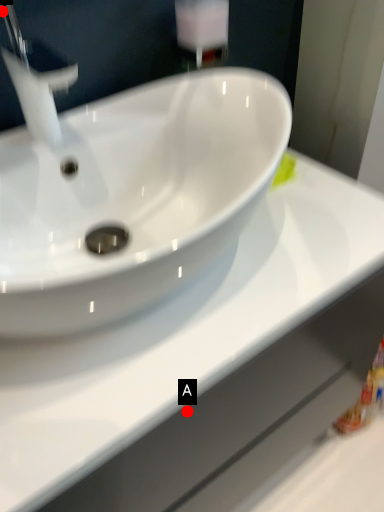
Question: Two points are circled on the image, labeled by A and B beside each circle. Which point is closer to the camera taking this photo?

Choices:
 (A) A is closer
 (B) B is closer

Answer: (A)